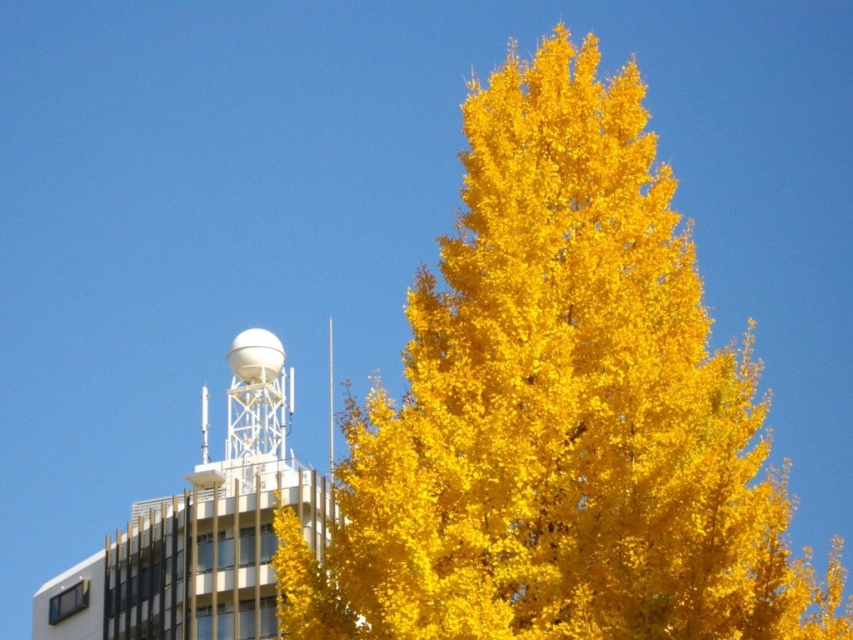
Question: Is golden yellow foliage at center closer to the viewer compared to white metallic tower at upper left?

Choices:
 (A) no
 (B) yes

Answer: (B)

Question: Can you confirm if golden yellow foliage at center is bigger than white matte water tower at upper left?

Choices:
 (A) no
 (B) yes

Answer: (B)

Question: Which object appears farthest from the camera in this image?

Choices:
 (A) white metallic tower at upper left
 (B) white matte water tower at upper left
 (C) golden yellow foliage at center

Answer: (B)

Question: Which point is farther to the camera?

Choices:
 (A) white metallic tower at upper left
 (B) golden yellow foliage at center
 (C) white matte water tower at upper left

Answer: (C)

Question: Can you confirm if white metallic tower at upper left is thinner than white matte water tower at upper left?

Choices:
 (A) no
 (B) yes

Answer: (A)

Question: Based on their relative distances, which object is farther from the golden yellow foliage at center?

Choices:
 (A) white metallic tower at upper left
 (B) white matte water tower at upper left

Answer: (B)